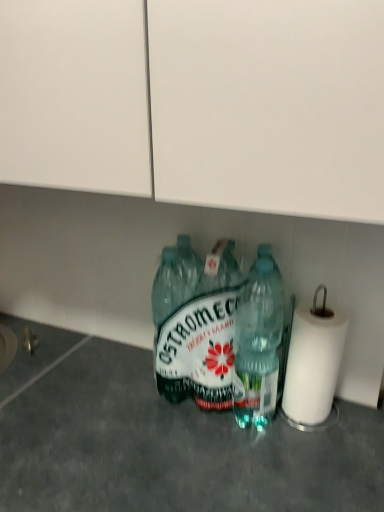
Where is `free space above transparent plastic bottles at center (from a real-world perspective)`? This screenshot has height=512, width=384. free space above transparent plastic bottles at center (from a real-world perspective) is located at coordinates (178, 432).